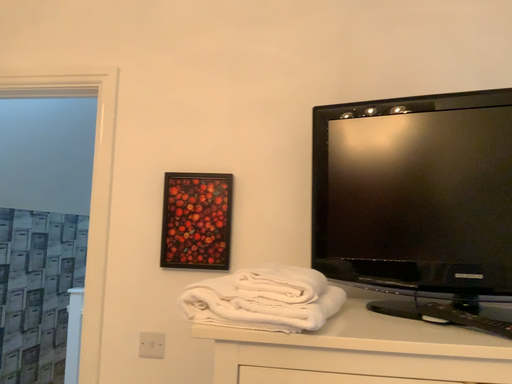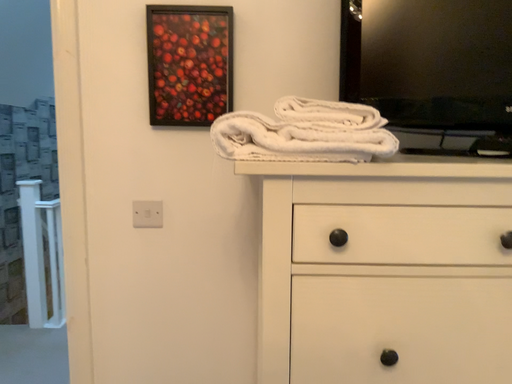
Question: Which way did the camera rotate in the video?

Choices:
 (A) rotated left
 (B) rotated right

Answer: (B)